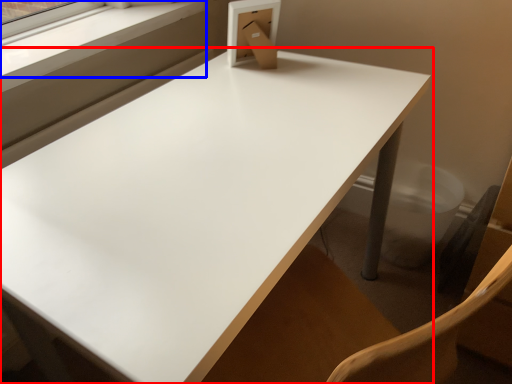
Question: Which object is closer to the camera taking this photo, table (highlighted by a red box) or window frame (highlighted by a blue box)?

Choices:
 (A) table
 (B) window frame

Answer: (A)